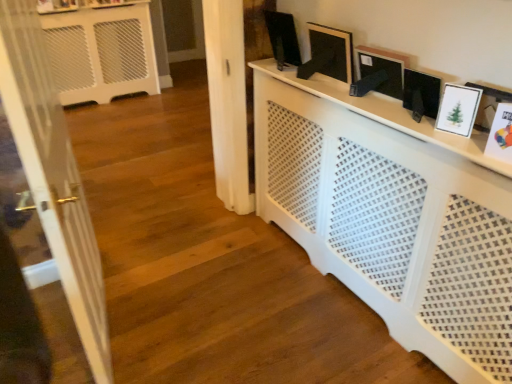
This screenshot has height=384, width=512. What are the coordinates of `vacant space in front of black matte picture frame at upper center, which is the second picture frame from left to right` in the screenshot? It's located at tap(349, 92).